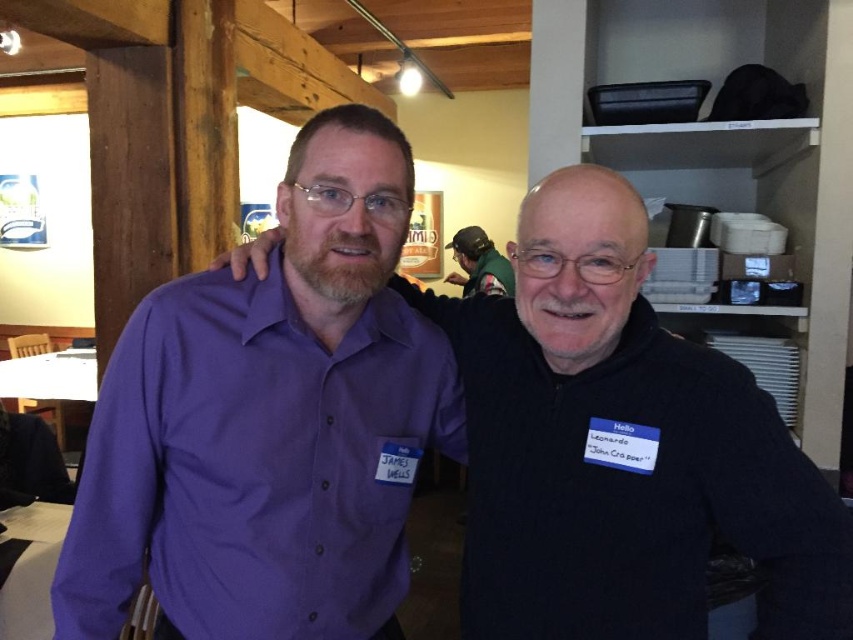
Question: Is purple shirt at center to the right of purple smooth shirt at left from the viewer's perspective?

Choices:
 (A) no
 (B) yes

Answer: (B)

Question: Estimate the real-world distances between objects in this image. Which object is closer to the purple shirt at center?

Choices:
 (A) purple smooth shirt at left
 (B) green fabric shirt at upper center

Answer: (A)

Question: Considering the relative positions of purple shirt at center and green fabric shirt at upper center in the image provided, where is purple shirt at center located with respect to green fabric shirt at upper center?

Choices:
 (A) left
 (B) right

Answer: (A)

Question: Is purple smooth shirt at left below green fabric shirt at upper center?

Choices:
 (A) yes
 (B) no

Answer: (A)

Question: Which point is closer to the camera taking this photo?

Choices:
 (A) (790, 531)
 (B) (219, 387)

Answer: (A)

Question: Based on their relative distances, which object is farther from the green fabric shirt at upper center?

Choices:
 (A) purple smooth shirt at left
 (B) purple shirt at center

Answer: (A)